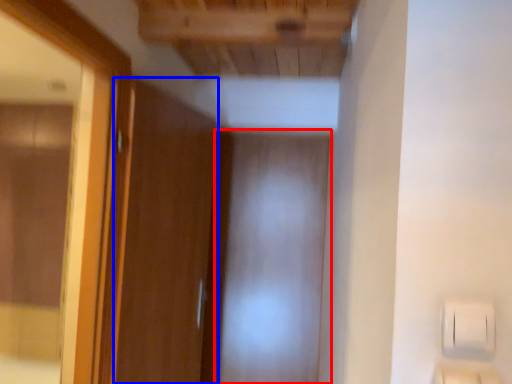
Question: Among these objects, which one is farthest to the camera, screen door (highlighted by a red box) or door (highlighted by a blue box)?

Choices:
 (A) screen door
 (B) door

Answer: (A)